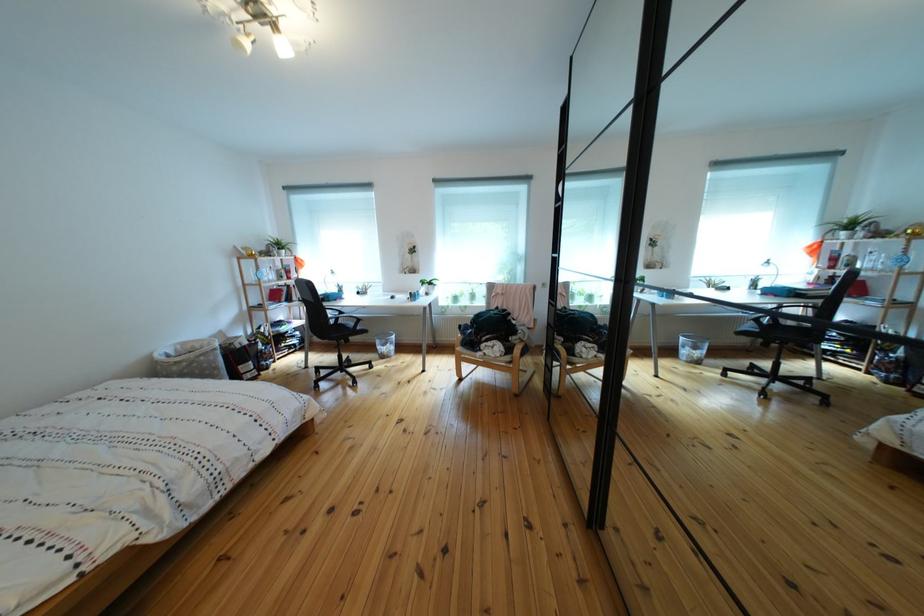
Where would you resting arm the black chair armrest? Please return your answer as a coordinate pair (x, y).

(334, 307)